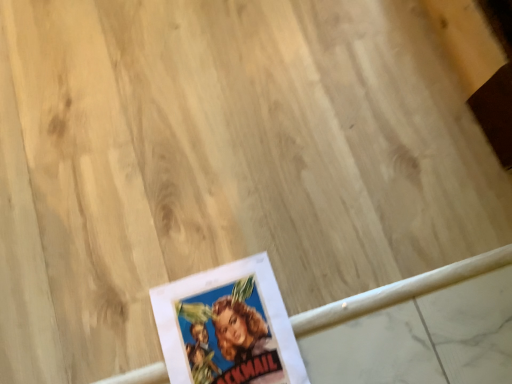
You are a GUI agent. You are given a task and a screenshot of the screen. Output one action in this format:
    pyautogui.click(x=<x>, y=<y>)
    Task: Click on the blank space to the left of matte paper picture frame at lower center
    The height and width of the screenshot is (384, 512).
    Given the screenshot: What is the action you would take?
    [x=100, y=308]